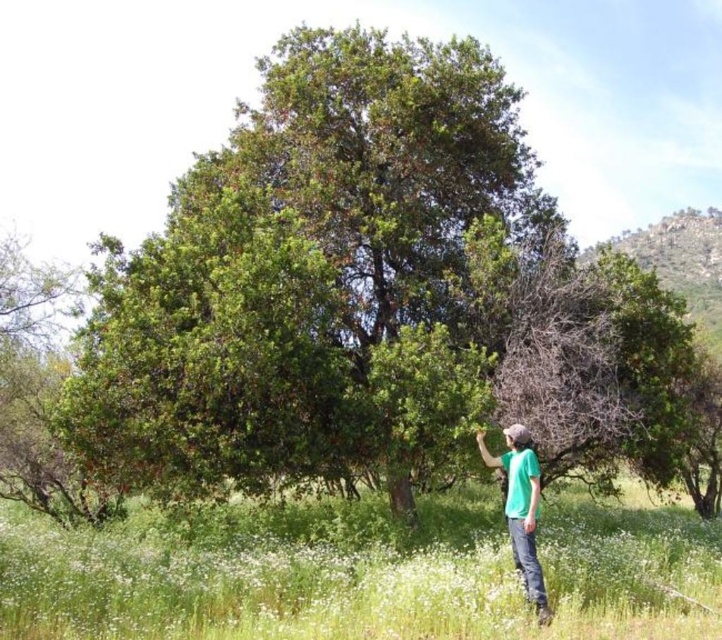
You are standing in the outdoor scene and want to place a small garden ornament between the green soft grass at lower center and the green matte shirt at lower right. Based on their positions, which object should the ornament be closer to?

The green soft grass at lower center is closer to the viewer than the green matte shirt at lower right, so the ornament should be placed closer to the green soft grass at lower center.

You are a photographer planning to capture a closeup shot of the green soft grass at lower center and the green matte shirt at lower right. Which object should you focus on first if you want to ensure both are in the frame without moving the camera?

→ The green soft grass at lower center is larger in size than the green matte shirt at lower right, so you should focus on the green soft grass at lower center first to ensure it fits within the frame before adjusting for the smaller green matte shirt at lower right.